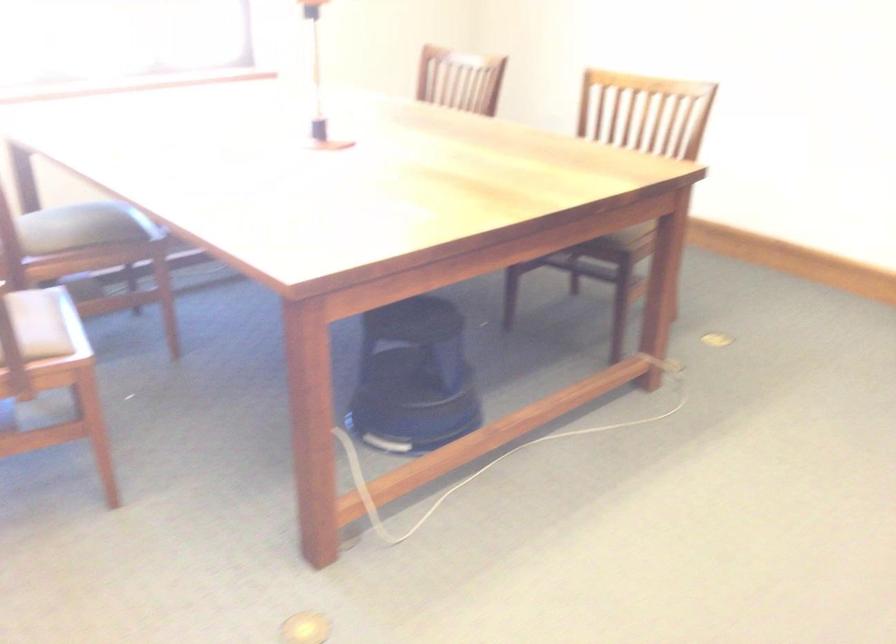
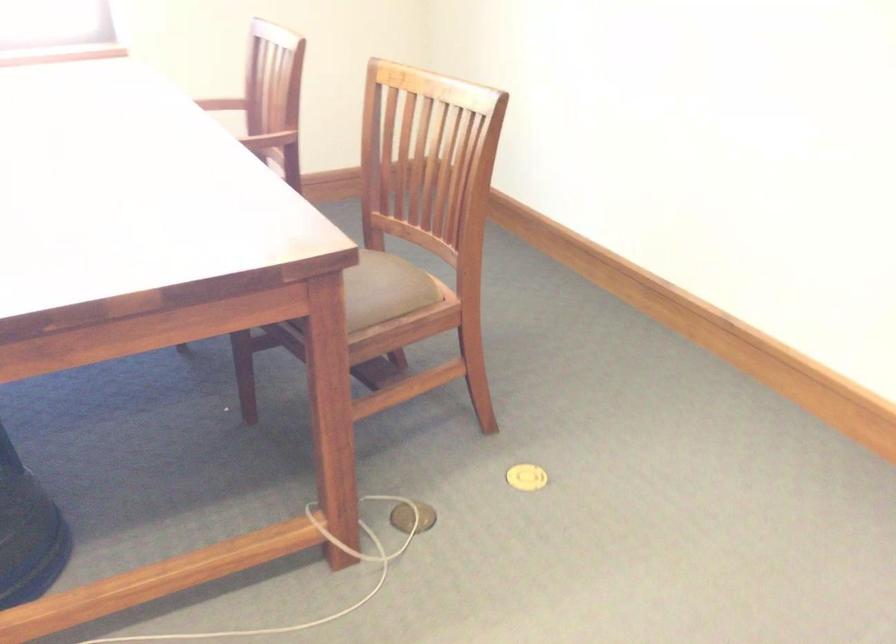
Which direction would the cameraman need to move to produce the second image?

The movement direction of the cameraman is right, forward.